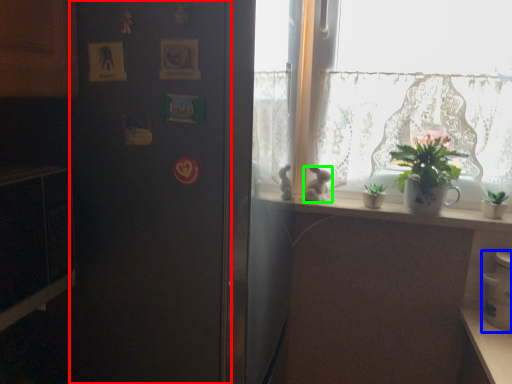
Question: Which is farther away from screen door (highlighted by a red box)? appliance (highlighted by a blue box) or rabbit (highlighted by a green box)?

Choices:
 (A) appliance
 (B) rabbit

Answer: (A)